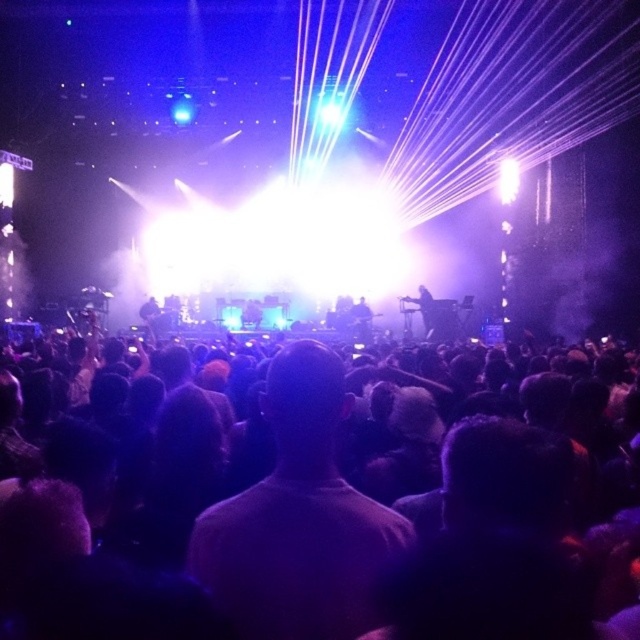
Question: Is black matte crowd at center wider than black matte guitar at center?

Choices:
 (A) yes
 (B) no

Answer: (A)

Question: Can you confirm if black matte crowd at center is wider than black matte guitar at center?

Choices:
 (A) no
 (B) yes

Answer: (B)

Question: Is black matte crowd at center to the left of black matte guitar at center from the viewer's perspective?

Choices:
 (A) no
 (B) yes

Answer: (B)